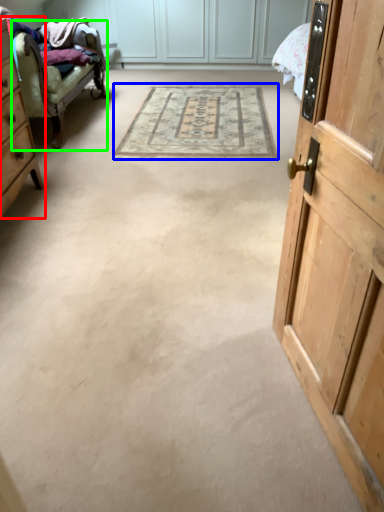
Question: Which object is positioned closest to cabinetry (highlighted by a red box)? Select from mat (highlighted by a blue box) and chair (highlighted by a green box).

Choices:
 (A) mat
 (B) chair

Answer: (B)